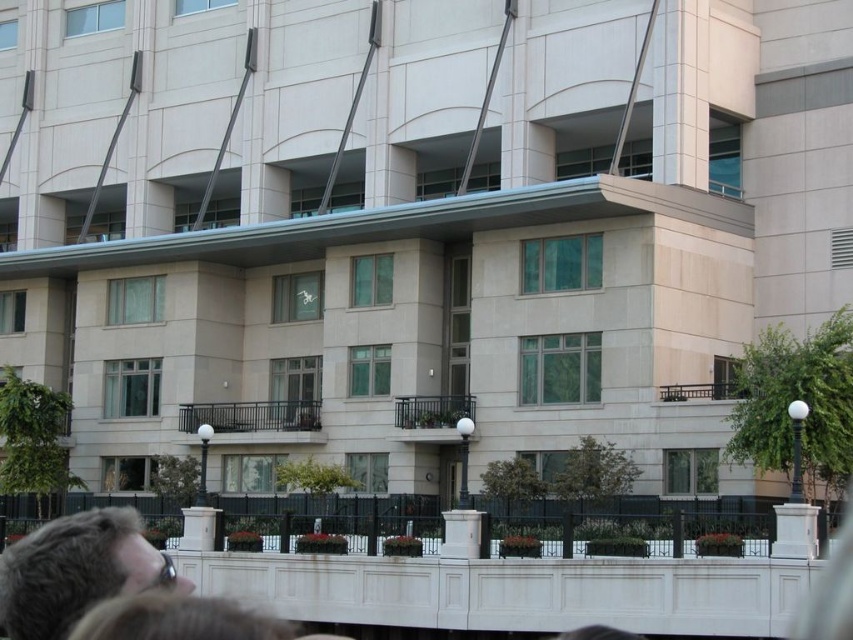
Who is lower down, blonde hair at lower left or brown hair at lower center?

brown hair at lower center is below.

What do you see at coordinates (177, 620) in the screenshot?
I see `blonde hair at lower left` at bounding box center [177, 620].

I want to click on blonde hair at lower left, so click(x=177, y=620).

Does dark brown hair at lower left have a lesser width compared to blonde hair at lower left?

No, dark brown hair at lower left is not thinner than blonde hair at lower left.

This screenshot has width=853, height=640. I want to click on dark brown hair at lower left, so click(77, 570).

Between dark brown hair at lower left and brown hair at lower center, which one appears on the right side from the viewer's perspective?

From the viewer's perspective, brown hair at lower center appears more on the right side.

Between dark brown hair at lower left and brown hair at lower center, which one appears on the left side from the viewer's perspective?

dark brown hair at lower left

Which is in front, point (49, 595) or point (589, 632)?

Point (49, 595) is in front.

The height and width of the screenshot is (640, 853). Identify the location of dark brown hair at lower left. (77, 570).